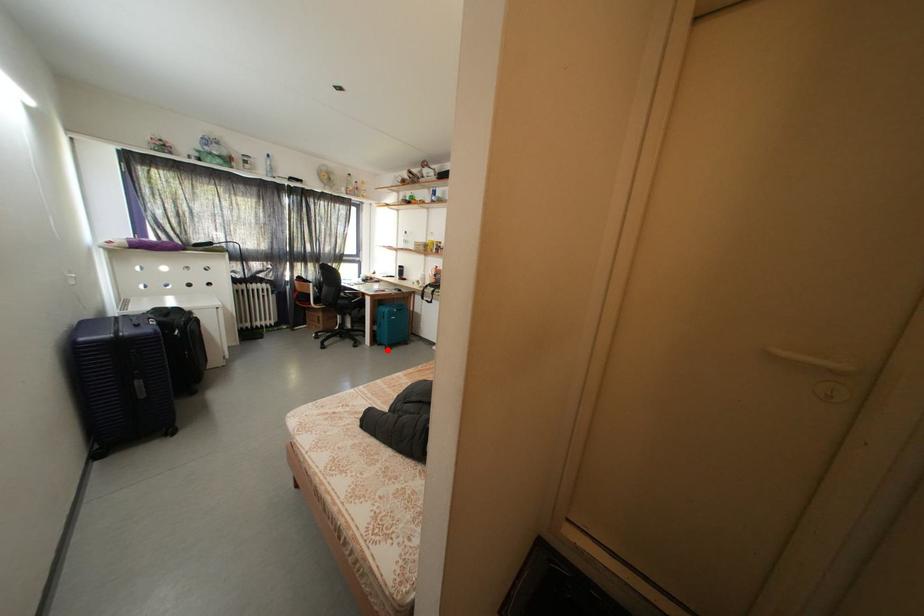
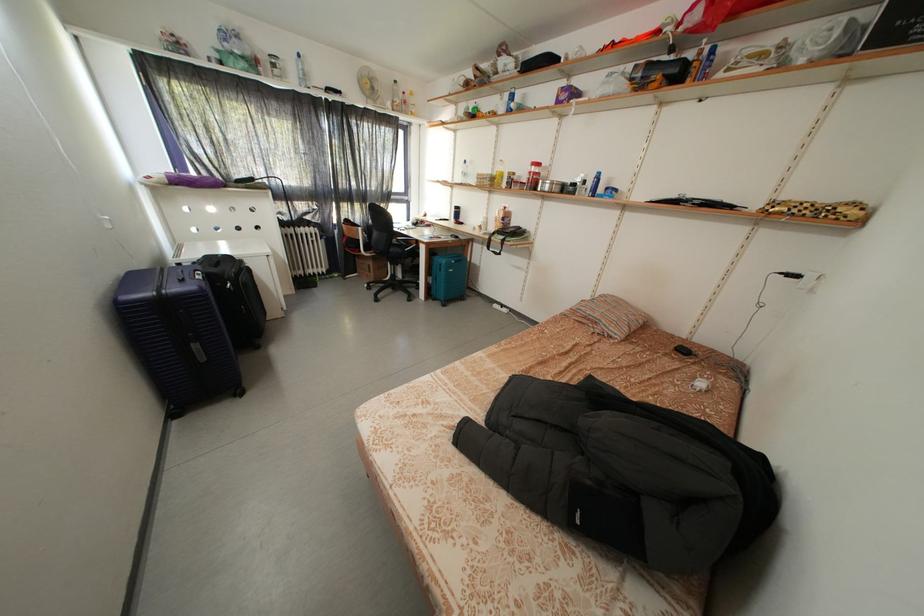
The point at the highlighted location is marked in the first image. Where is the corresponding point in the second image?

(442, 305)